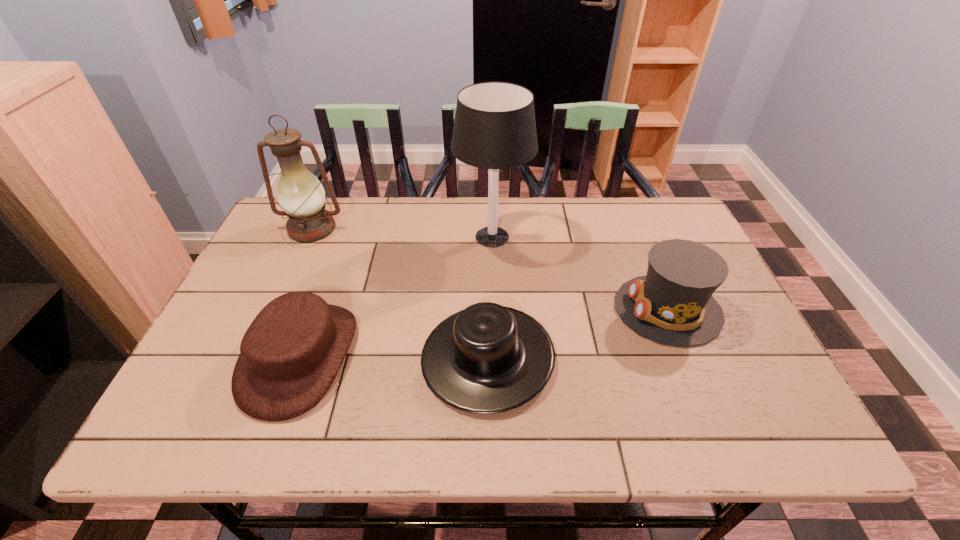
The width and height of the screenshot is (960, 540). Find the location of `free point located with goggles on the front of the third tallest object`. free point located with goggles on the front of the third tallest object is located at coordinates (566, 309).

The image size is (960, 540). I want to click on vacant space located 0.200m on the right of the second hat from right to left, so click(641, 357).

Image resolution: width=960 pixels, height=540 pixels. I want to click on vacant space located 0.290m on the back of the leftmost hat, so click(x=344, y=233).

This screenshot has height=540, width=960. I want to click on table lamp present at the far edge, so click(494, 128).

This screenshot has height=540, width=960. Find the location of `oil lamp at the far edge`. oil lamp at the far edge is located at coordinates (301, 195).

Identify the location of oil lamp that is at the left edge. This screenshot has width=960, height=540. (301, 195).

You are a GUI agent. You are given a task and a screenshot of the screen. Output one action in this format:
    pyautogui.click(x=<x>, y=<y>)
    Task: Click on the hat at the left edge
    The height and width of the screenshot is (540, 960).
    Given the screenshot: What is the action you would take?
    pyautogui.click(x=291, y=353)

Locate an element on the screen. object that is at the right edge is located at coordinates (673, 304).

You are a GUI agent. You are given a task and a screenshot of the screen. Output one action in this format:
    pyautogui.click(x=<x>, y=<y>)
    Task: Click on the object at the far left corner
    
    Given the screenshot: What is the action you would take?
    (x=301, y=195)

Where is `object located in the near left corner section of the desktop`? object located in the near left corner section of the desktop is located at coordinates (291, 353).